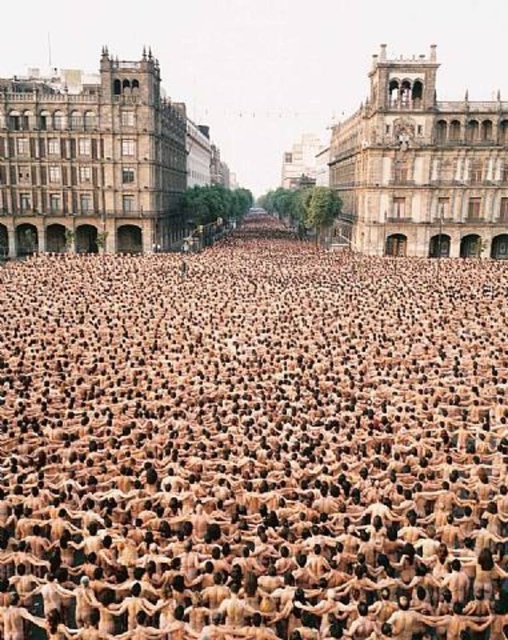
You are standing at the point closest to the viewer in the scene. You want to walk straight ahead to the far end of the plaza. Will you pass through the point labeled as point [502,269] or point [489,150] first?

You will pass through point [489,150] first because it is closer to the viewer than point [502,269], which is positioned behind it.